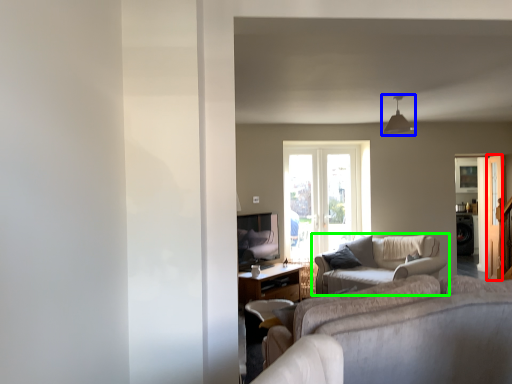
Question: Estimate the real-world distances between objects in this image. Which object is farther from screen door (highlighted by a red box), light fixture (highlighted by a blue box) or studio couch (highlighted by a green box)?

Choices:
 (A) light fixture
 (B) studio couch

Answer: (B)